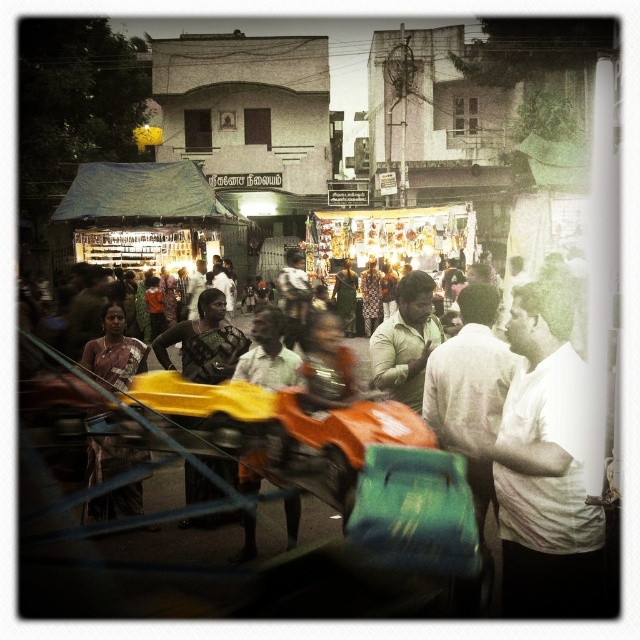
Question: Which point is farther to the camera?

Choices:
 (A) white cotton shirt at center-right
 (B) white shirt at center
 (C) matte black dress at center

Answer: (C)

Question: Which of the following is the farthest from the observer?

Choices:
 (A) white shirt at center
 (B) white cotton shirt at center-right
 (C) light green shirt at center

Answer: (C)

Question: Is the position of white cotton shirt at center-right more distant than that of matte black dress at center?

Choices:
 (A) yes
 (B) no

Answer: (B)

Question: Is matte black dress at center above matte brown saree at center?

Choices:
 (A) yes
 (B) no

Answer: (A)

Question: Does matte brown saree at center come behind white shirt at center?

Choices:
 (A) no
 (B) yes

Answer: (B)

Question: Which object is farther from the camera taking this photo?

Choices:
 (A) white shirt at center
 (B) white cotton shirt at center-right

Answer: (A)